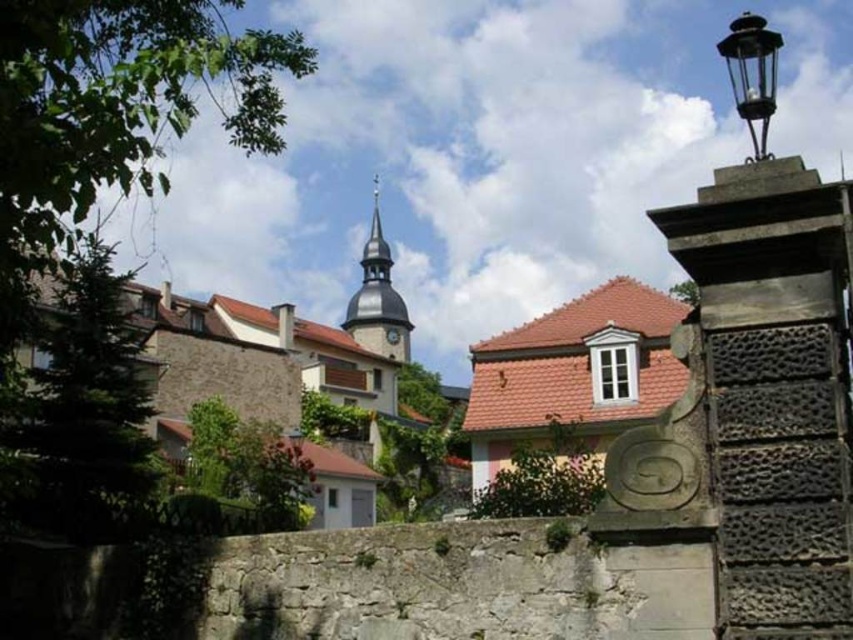
From the picture: Is smooth gray steeple at center positioned behind black metal/iron streetlamp at upper right?

Yes, smooth gray steeple at center is behind black metal/iron streetlamp at upper right.

How much distance is there between smooth gray steeple at center and black metal/iron streetlamp at upper right?

smooth gray steeple at center and black metal/iron streetlamp at upper right are 149.92 meters apart.

Does point (369, 240) come behind point (753, 129)?

Yes, point (369, 240) is behind point (753, 129).

This screenshot has height=640, width=853. I want to click on smooth gray steeple at center, so click(376, 298).

Is smooth gray steeple at center behind metallic gray clock at center?

No, it is in front of metallic gray clock at center.

Can you confirm if smooth gray steeple at center is smaller than metallic gray clock at center?

Actually, smooth gray steeple at center might be larger than metallic gray clock at center.

Does point (387, 264) lie behind point (398, 340)?

Yes, point (387, 264) is behind point (398, 340).

Find the location of a particular element. The height and width of the screenshot is (640, 853). smooth gray steeple at center is located at coordinates (x=376, y=298).

Is black metal/iron streetlamp at upper right above metallic gray clock at center?

Yes.

Measure the distance between point [735,51] and camera.

Point [735,51] and camera are 12.24 meters apart.

The height and width of the screenshot is (640, 853). What are the coordinates of `black metal/iron streetlamp at upper right` in the screenshot? It's located at (752, 74).

The image size is (853, 640). What are the coordinates of `black metal/iron streetlamp at upper right` in the screenshot? It's located at (752, 74).